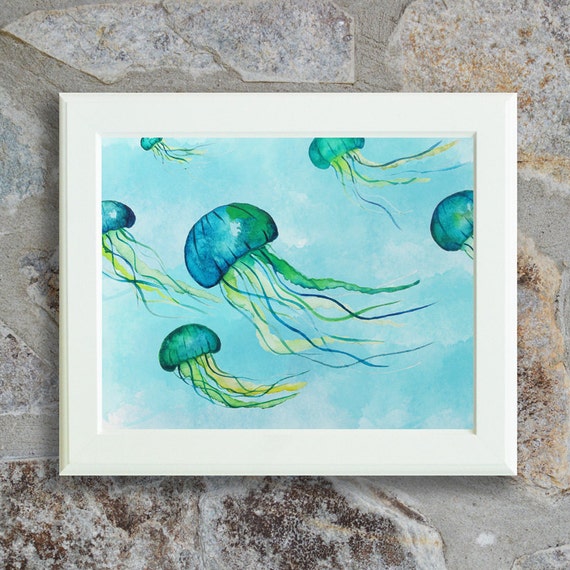
In order to click on white frame in this screenshot , I will do `click(498, 457)`.